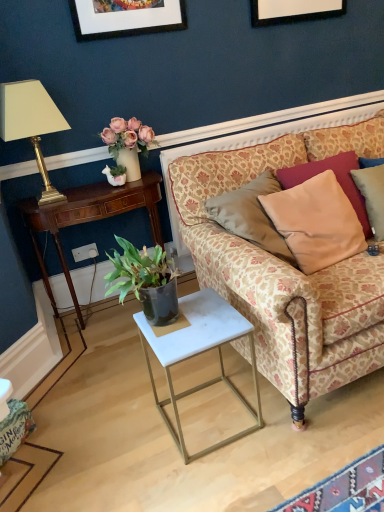
The image size is (384, 512). What are the coordinates of `vacant area to the right of white marble table at lower center` in the screenshot? It's located at (290, 423).